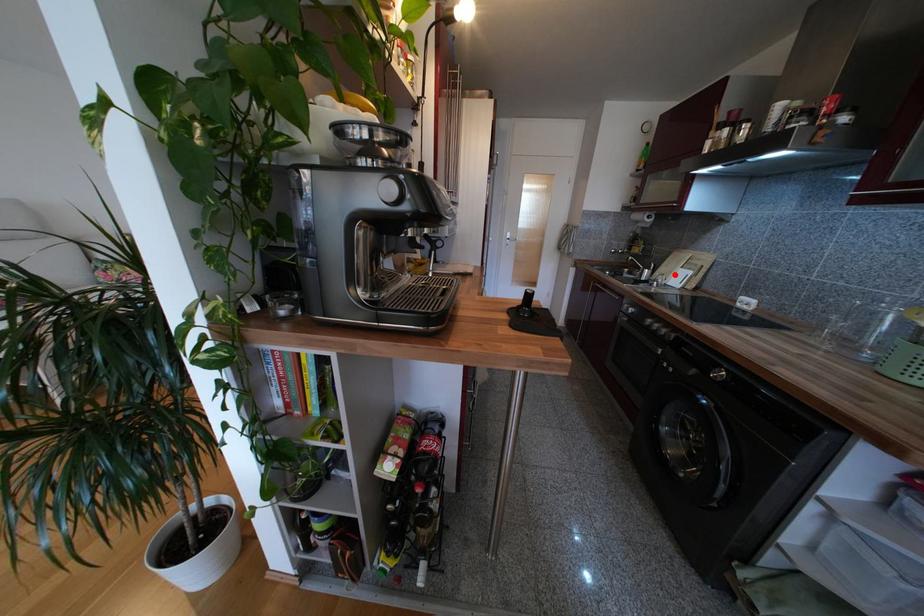
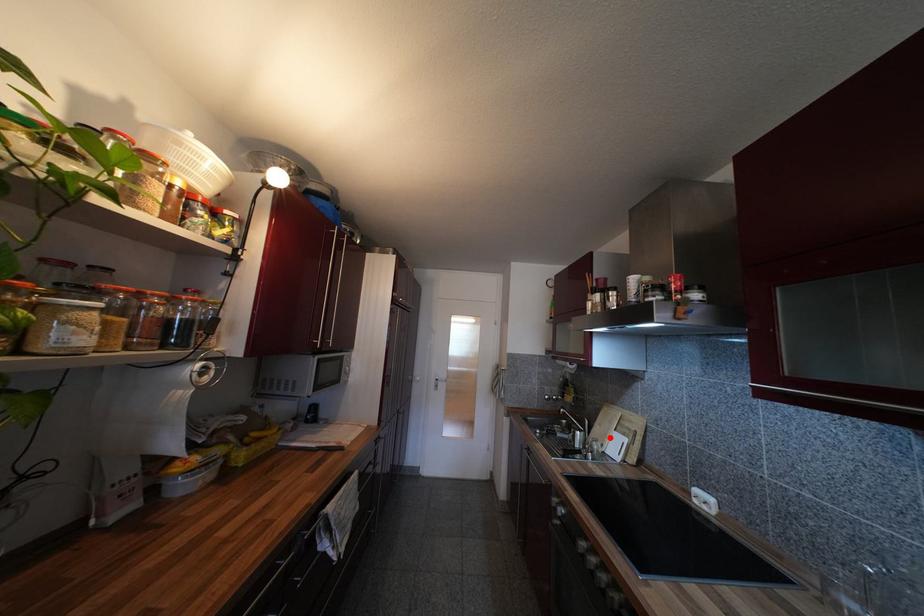
I am providing you with two images of the same scene from different viewpoints. A red point is marked on the first image and another point is marked on the second image. Are the points marked in image1 and image2 representing the same 3D position?

Yes